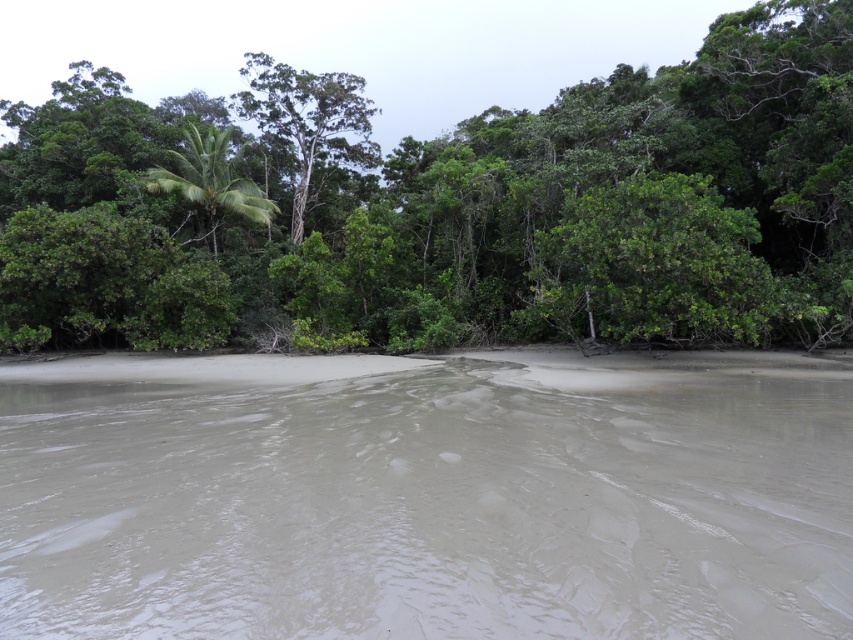
Question: Which is farther from the green leafy tree at upper center?

Choices:
 (A) gray mud at center
 (B) green leafy tree at center

Answer: (A)

Question: Does gray mud at center have a smaller size compared to green leafy tree at center?

Choices:
 (A) no
 (B) yes

Answer: (B)

Question: Which is nearer to the gray mud at center?

Choices:
 (A) green leafy tree at center
 (B) green leafy tree at upper center
 (C) green leafy palm at upper left

Answer: (A)

Question: Estimate the real-world distances between objects in this image. Which object is farther from the green leafy tree at center?

Choices:
 (A) green leafy palm at upper left
 (B) gray mud at center
 (C) green leafy tree at upper center

Answer: (B)

Question: Is green leafy tree at center to the left of green leafy tree at upper center from the viewer's perspective?

Choices:
 (A) yes
 (B) no

Answer: (A)

Question: Is gray mud at center in front of green leafy tree at center?

Choices:
 (A) no
 (B) yes

Answer: (B)